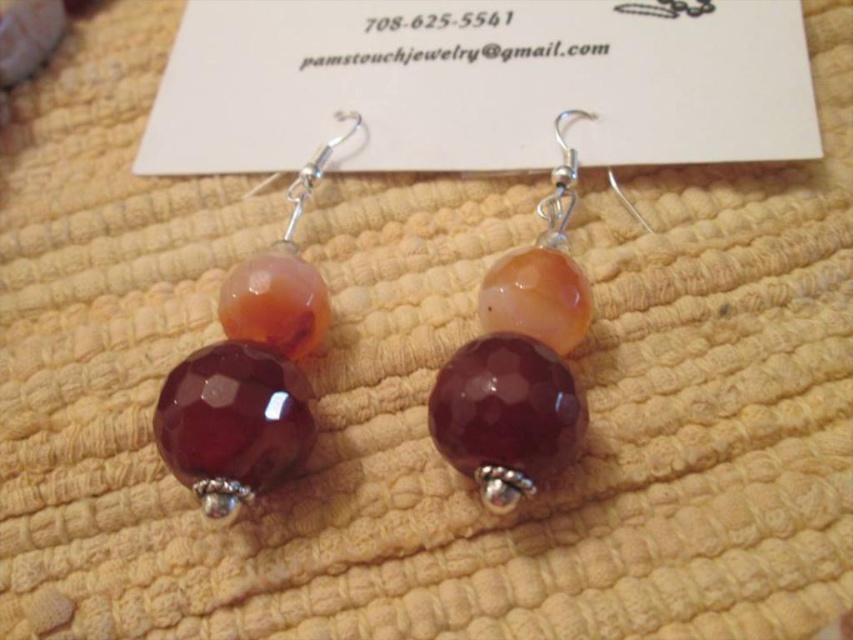
You are a customer at an art fair and see the matte orange bead at center displayed on a stand. The stand is 4 feet tall. Can you reach the bead to touch it without standing on something?

The matte orange bead at center is 3.78 feet from viewer, so yes, you can reach it since it is slightly below the stand height of 4 feet.

What is the relationship between the heights of the ruby glass bead at center and the faceted purple glass bead at center?

The ruby glass bead at center is shorter than the faceted purple glass bead at center.

What is the spatial relationship between the ruby glass bead at center and the faceted purple glass bead at center in the image?

The ruby glass bead at center is positioned in front of the faceted purple glass bead at center.